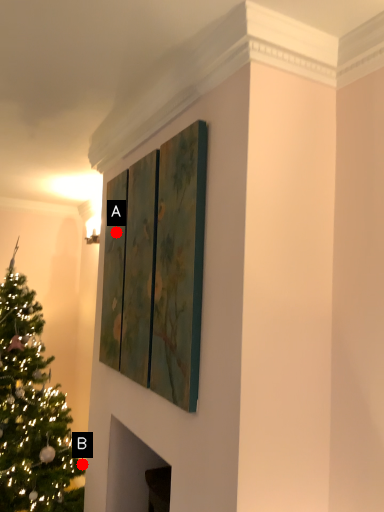
Question: Two points are circled on the image, labeled by A and B beside each circle. Which point is closer to the camera?

Choices:
 (A) A is closer
 (B) B is closer

Answer: (A)